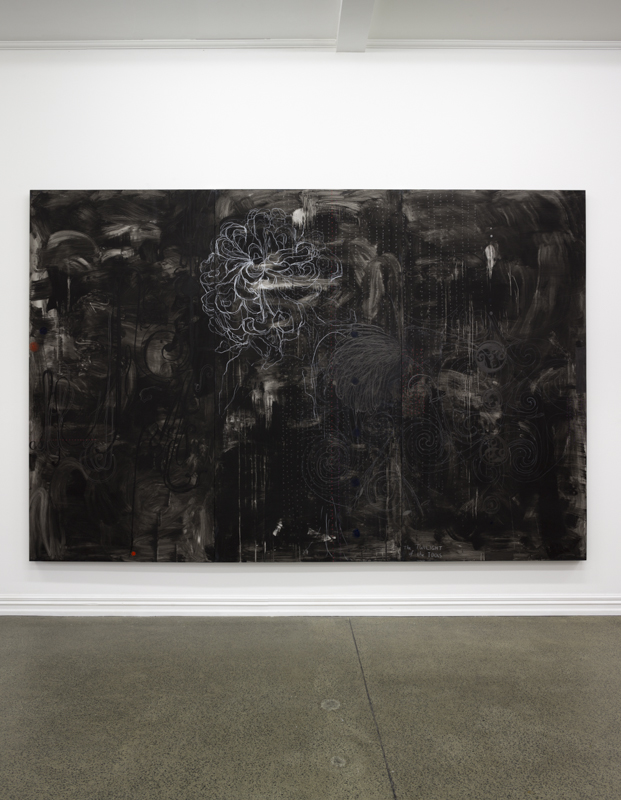
Where is `white drip type lines on painting`? The width and height of the screenshot is (621, 800). white drip type lines on painting is located at coordinates (238, 534), (253, 506), (263, 541).